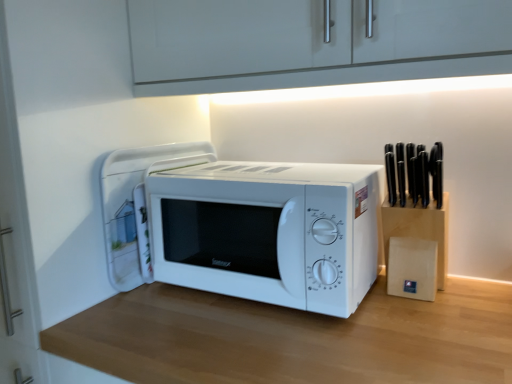
Image resolution: width=512 pixels, height=384 pixels. Identify the location of free space in front of white glossy microwave at center. (153, 305).